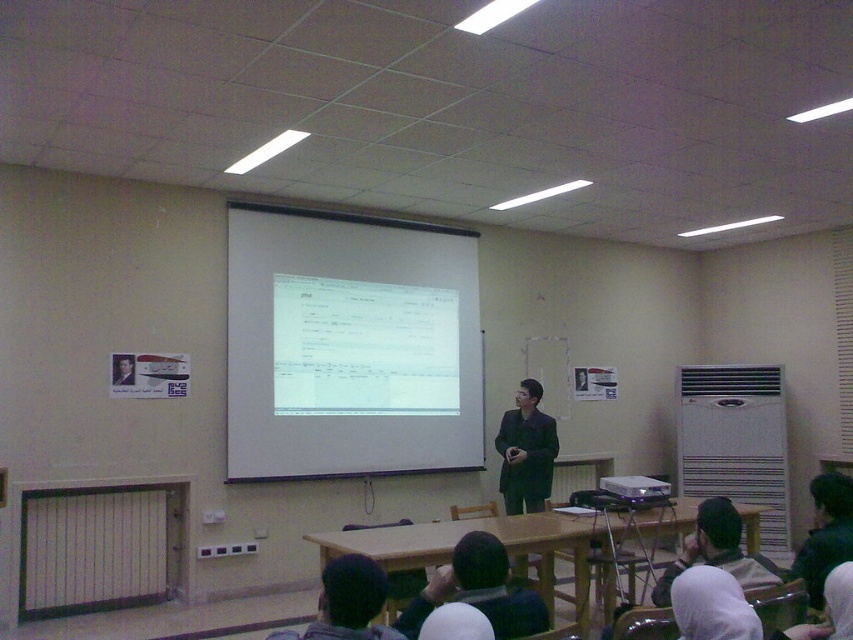
You are standing in the classroom and need to locate the white matte projection screen at center. According to the coordinates provided, where exactly is it positioned?

The white matte projection screen at center is located at point (349, 346).

You are a student sitting in the classroom and need to determine which object is taller between the white matte projection screen at center and the dark matte suit at center. Based on the scene, which one is taller?

The white matte projection screen at center is much taller than the dark matte suit at center.